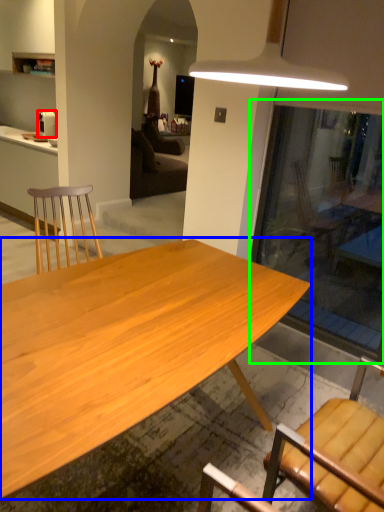
Question: Based on their relative distances, which object is farther from coffee maker (highlighted by a red box)? Choose from desk (highlighted by a blue box) and glass door (highlighted by a green box).

Choices:
 (A) desk
 (B) glass door

Answer: (A)